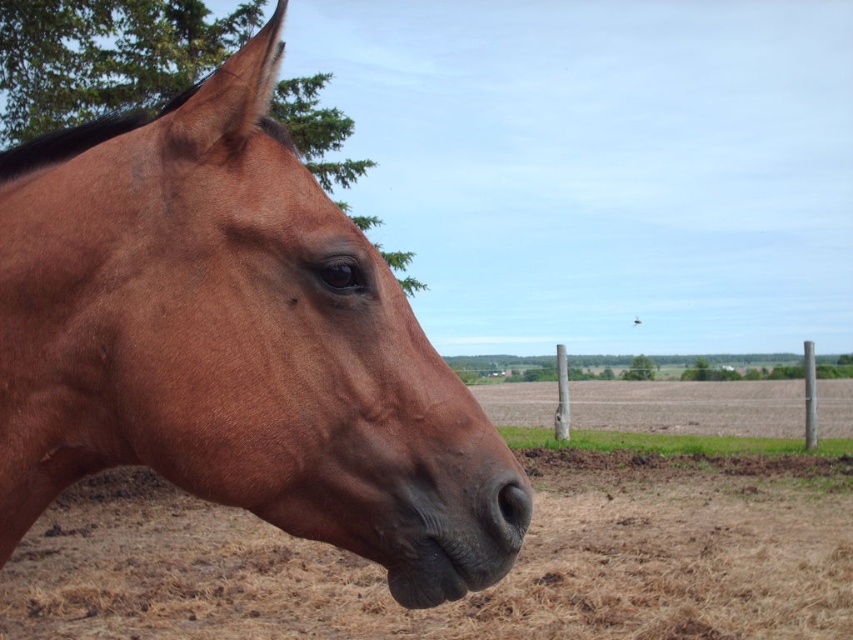
Question: Estimate the real-world distances between objects in this image. Which object is closer to the black matte nose at center?

Choices:
 (A) brown dirt field at lower left
 (B) wooden post at center

Answer: (A)

Question: Among these points, which one is nearest to the camera?

Choices:
 (A) (727, 557)
 (B) (537, 388)
 (C) (178, 257)

Answer: (C)

Question: Can you confirm if shiny brown horse at left is smaller than wooden post at center?

Choices:
 (A) yes
 (B) no

Answer: (A)

Question: Does brown dirt field at lower left have a smaller size compared to wooden post at center?

Choices:
 (A) yes
 (B) no

Answer: (B)

Question: Considering the real-world distances, which object is closest to the brown dirt field at lower left?

Choices:
 (A) black matte nose at center
 (B) shiny brown horse at left
 (C) wooden post at center

Answer: (B)

Question: Is shiny brown horse at left positioned at the back of brown dirt field at lower left?

Choices:
 (A) yes
 (B) no

Answer: (B)